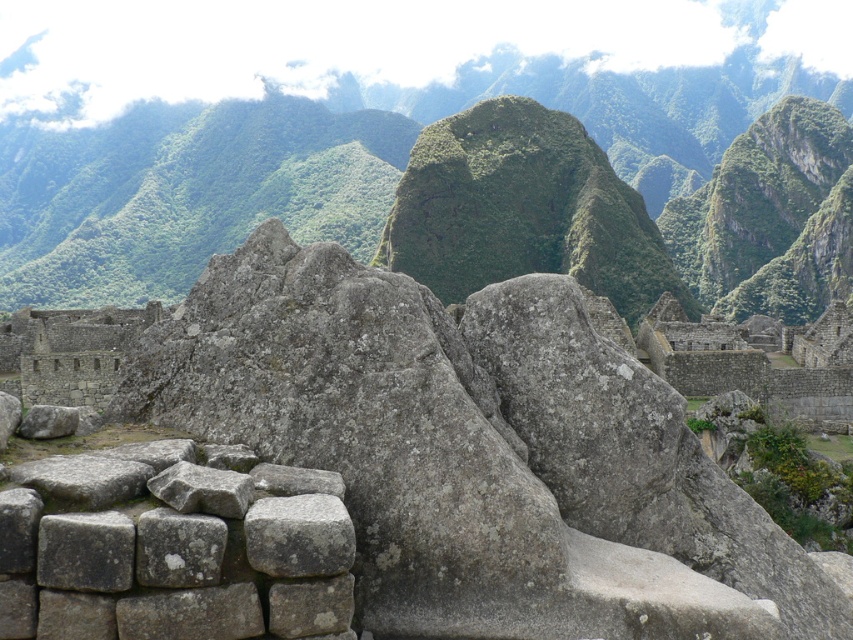
Question: Does gray stone wall at center appear on the right side of gray rough stone at center?

Choices:
 (A) yes
 (B) no

Answer: (B)

Question: Which point is closer to the camera taking this photo?

Choices:
 (A) (357, 99)
 (B) (767, 532)

Answer: (B)

Question: Which point is closer to the camera?

Choices:
 (A) gray rough stone at center
 (B) gray stone wall at center

Answer: (B)

Question: From the image, what is the correct spatial relationship of green rock formation at center in relation to gray rough stone at center?

Choices:
 (A) right
 (B) left

Answer: (B)

Question: Among these points, which one is farthest from the camera?

Choices:
 (A) (653, 557)
 (B) (144, 180)
 (C) (318, 544)

Answer: (B)

Question: Does gray stone wall at center have a lesser width compared to gray rough stone at center?

Choices:
 (A) yes
 (B) no

Answer: (B)